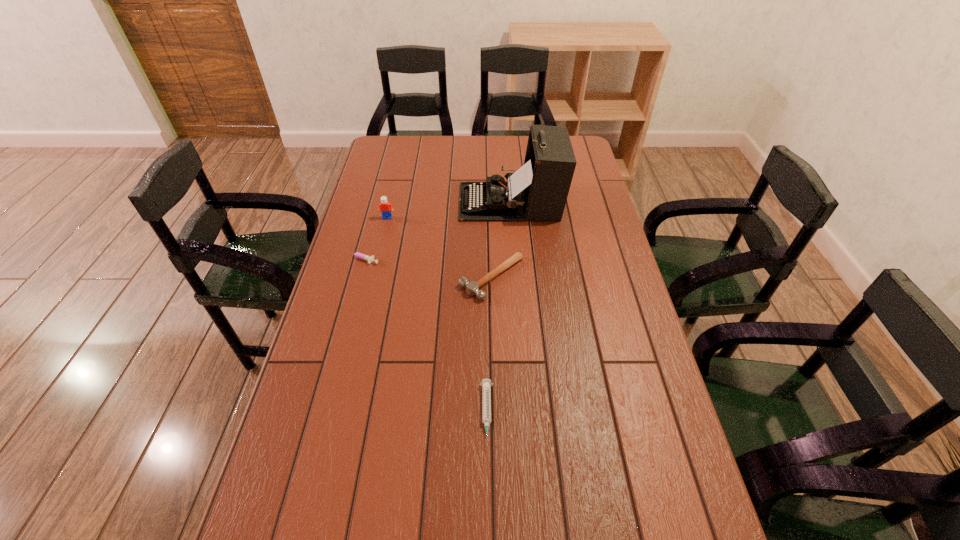
Where is `vacant area that lies between the second tallest object and the third tallest object`? This screenshot has width=960, height=540. vacant area that lies between the second tallest object and the third tallest object is located at coordinates (440, 248).

Find the location of `blank region between the nearest object and the typewriter`. blank region between the nearest object and the typewriter is located at coordinates (498, 308).

Locate an element on the screen. vacant area between the right syringe and the typewriter is located at coordinates (498, 308).

Locate an element on the screen. The height and width of the screenshot is (540, 960). vacant space that is in between the third tallest object and the nearest object is located at coordinates (490, 346).

Find the location of `free point between the farther syringe and the Lego`. free point between the farther syringe and the Lego is located at coordinates (373, 238).

Identify the location of vacant area that lies between the farther syringe and the typewriter. This screenshot has height=540, width=960. pos(436,231).

Locate an element on the screen. free space between the hammer and the tallest object is located at coordinates (501, 240).

Find the location of a particular element. The height and width of the screenshot is (540, 960). free area in between the left syringe and the nearer syringe is located at coordinates (423, 336).

Locate an element on the screen. free space between the hammer and the farther syringe is located at coordinates [426, 268].

In order to click on vacant area that lies between the fourth shortest object and the nearest object in this screenshot , I will do `click(437, 316)`.